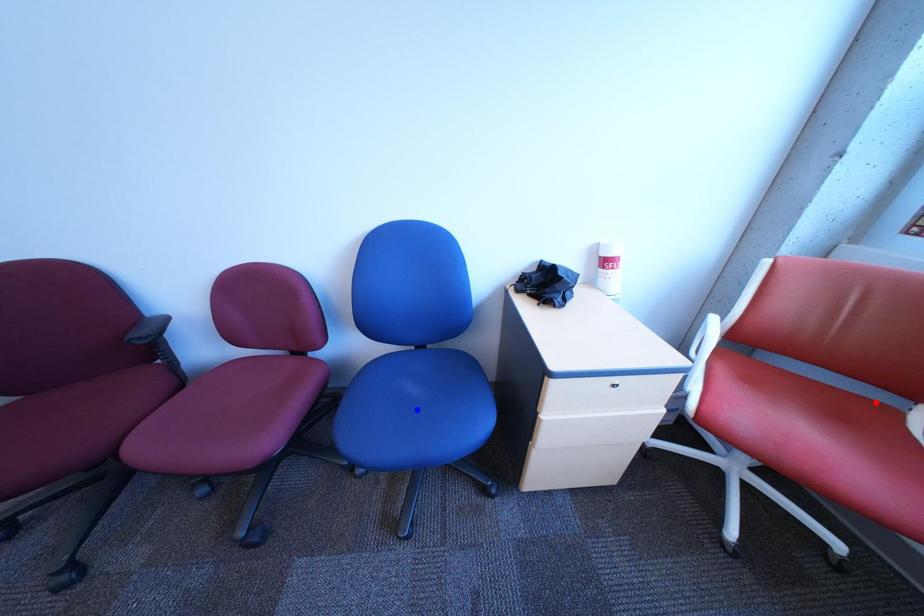
Question: Which of the two points in the image is closer to the camera?

Choices:
 (A) Blue point is closer.
 (B) Red point is closer.

Answer: (B)